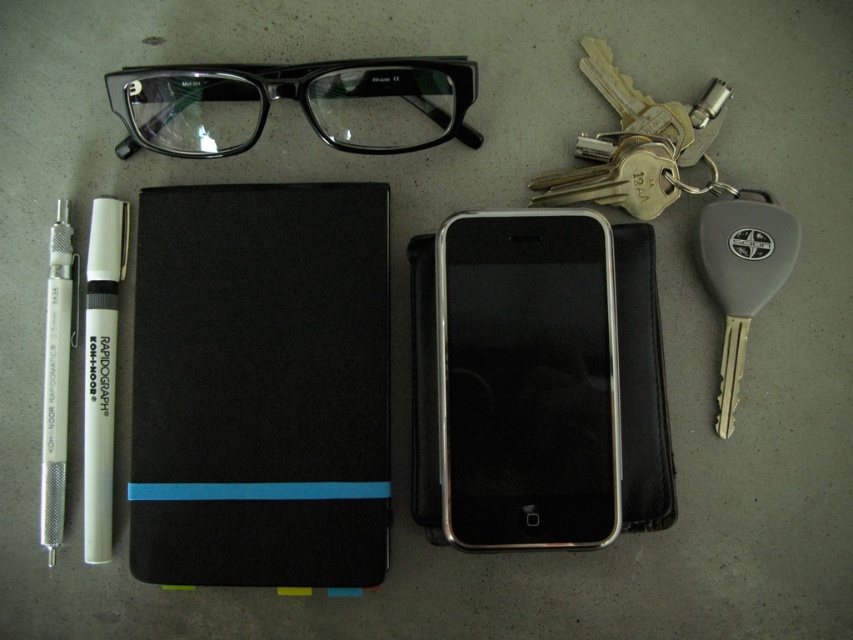
You have two white pens on your desk, a white matte pen at left and a white plastic pen at left. Which one is bigger?

The white matte pen at left is larger than the white plastic pen at left.

You are organizing items on a desk and need to place a new item between the black matte notebook at center and the transparent plastic glasses at top. Can you do this?

The black matte notebook at center is closer to you than the transparent plastic glasses at top, so you can place the new item between them by positioning it in the space between the two objects.